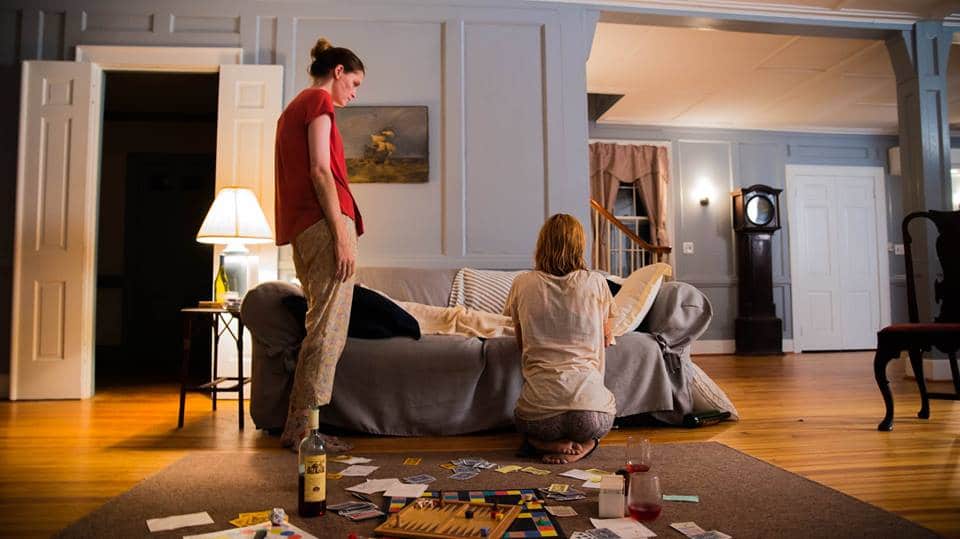
Identify the location of table. This screenshot has width=960, height=539. (192, 309).